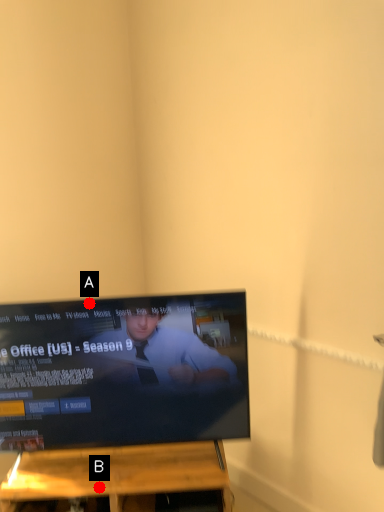
Question: Two points are circled on the image, labeled by A and B beside each circle. Which point is closer to the camera?

Choices:
 (A) A is closer
 (B) B is closer

Answer: (B)